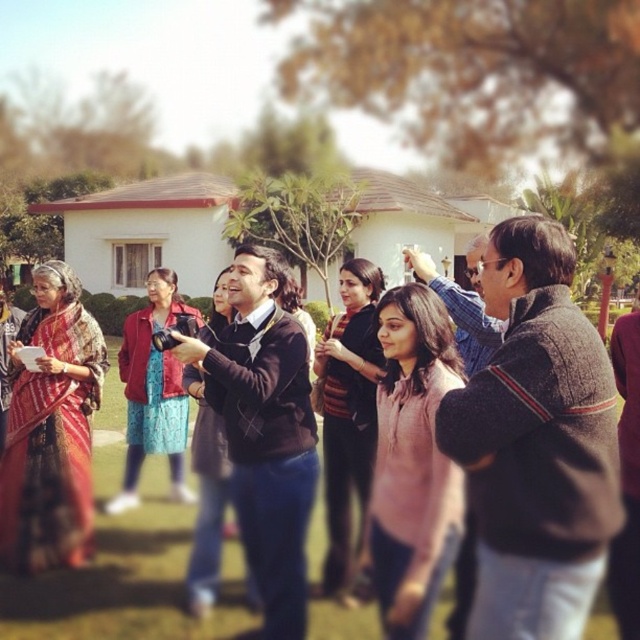
Is point (508, 536) less distant than point (168, 608)?

Yes, it is in front of point (168, 608).

The image size is (640, 640). I want to click on dark brown woolen sweater at center, so click(x=536, y=442).

Can you confirm if dark brown woolen sweater at center is positioned to the left of dark brown sweater at center?

Incorrect, dark brown woolen sweater at center is not on the left side of dark brown sweater at center.

Which of these two, dark brown woolen sweater at center or dark brown sweater at center, stands taller?

With more height is dark brown sweater at center.

Is point (525, 564) more distant than point (266, 477)?

No, it is not.

This screenshot has height=640, width=640. What are the coordinates of `dark brown woolen sweater at center` in the screenshot? It's located at (536, 442).

Is dark brown leather jacket at center wider than dark brown sweater at center?

Yes.

Can you confirm if dark brown leather jacket at center is positioned above dark brown sweater at center?

No.

Locate an element on the screen. dark brown leather jacket at center is located at coordinates (125, 561).

Find the location of a particular element. dark brown leather jacket at center is located at coordinates (125, 561).